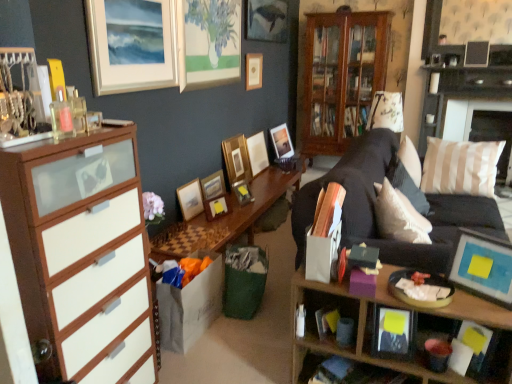
Question: Does point (348, 312) appear closer or farther from the camera than point (240, 173)?

Choices:
 (A) farther
 (B) closer

Answer: (B)

Question: Considering their positions, is wooden cabinet at lower right located in front of or behind wooden picture frame at center, which is the 8th picture frame from front to back?

Choices:
 (A) front
 (B) behind

Answer: (A)

Question: Which object is the farthest from the wooden shelf at lower right?

Choices:
 (A) matte black picture frame at lower right, arranged as the 2th picture frame when viewed from the front
 (B) wooden cabinet at lower right
 (C) white paper bag at lower center, which is the 2th book in bottom-to-top order
 (D) matte black book at lower center, which ranks as the 1th book in bottom-to-top order
 (E) wooden picture frame at center, which is the 4th picture frame from front to back

Answer: (E)

Question: Which of these objects is positioned farthest from the wooden picture frame at center, the sixth picture frame when ordered from back to front?

Choices:
 (A) white paper bag at lower center, the second book when ordered from top to bottom
 (B) wooden cabinet at lower right
 (C) matte wooden picture frame at upper center, which ranks as the first picture frame in back-to-front order
 (D) wooden picture frame at upper center, placed as the ninth picture frame when sorted from front to back
 (E) wooden picture frame at center, which is the 8th picture frame from front to back

Answer: (A)